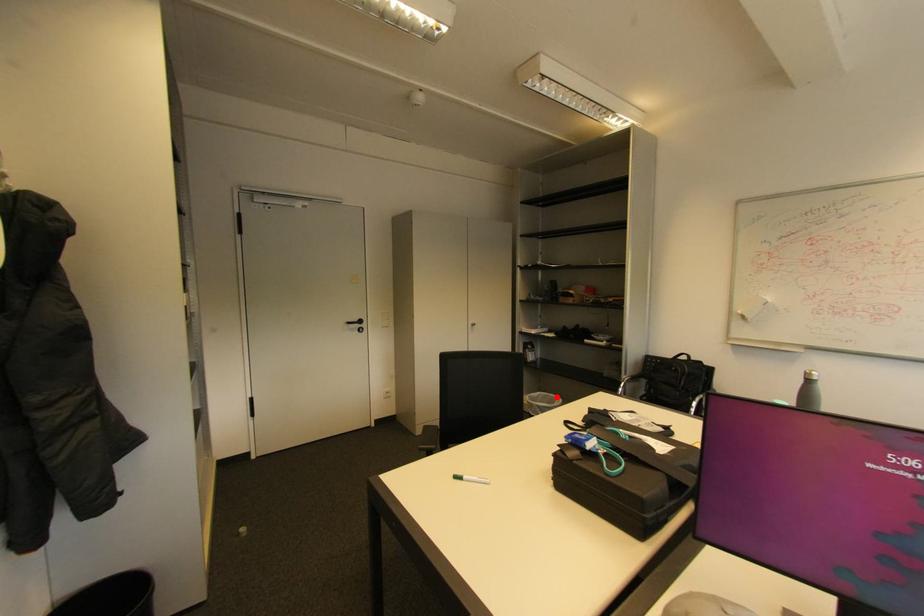
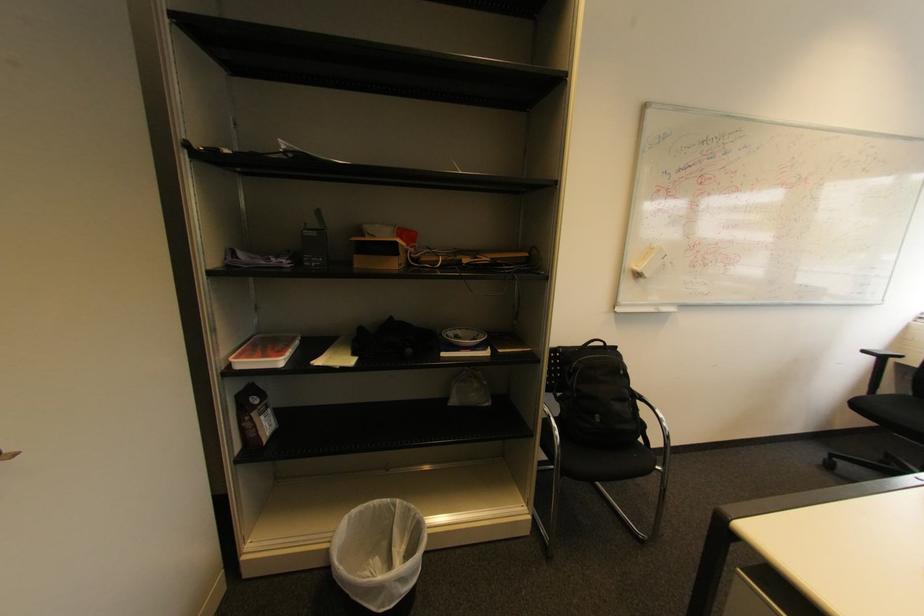
Question: I am providing you with two images of the same scene from different viewpoints. In image1, a red point is highlighted. Considering the same 3D point in image2, which of the following is correct?

Choices:
 (A) It is closer
 (B) It is farther

Answer: (A)